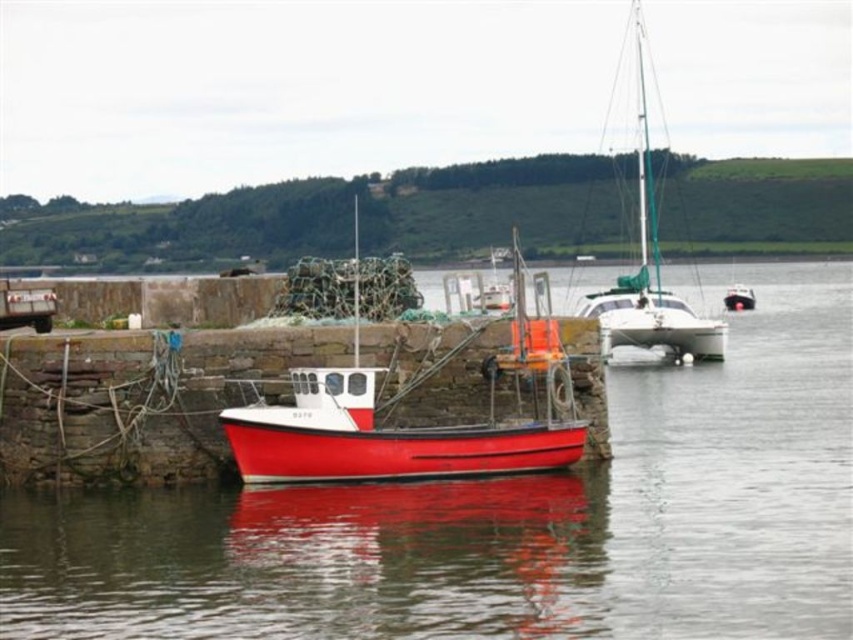
Question: Which object is farther from the camera taking this photo?

Choices:
 (A) red matte boat at center
 (B) smooth water at boat left

Answer: (A)

Question: Does smooth water at boat left have a greater width compared to red matte boat at center?

Choices:
 (A) yes
 (B) no

Answer: (A)

Question: Which is farther from the red matte boat at center?

Choices:
 (A) white glossy sailboat at upper right
 (B) smooth water at boat left

Answer: (B)

Question: In this image, where is smooth water at boat left located relative to white glossy sailboat at upper right?

Choices:
 (A) above
 (B) below

Answer: (B)

Question: Estimate the real-world distances between objects in this image. Which object is closer to the white glossy sailboat at upper right?

Choices:
 (A) red matte boat at center
 (B) smooth water at boat left

Answer: (A)

Question: Does red matte boat at center appear on the left side of white glossy sailboat at upper right?

Choices:
 (A) yes
 (B) no

Answer: (A)